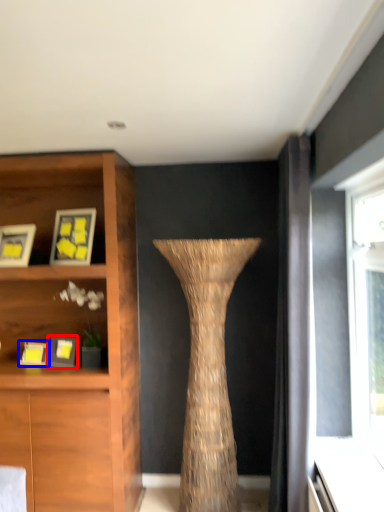
Question: Which point is further to the camera, picture frame (highlighted by a red box) or picture frame (highlighted by a blue box)?

Choices:
 (A) picture frame
 (B) picture frame

Answer: (B)